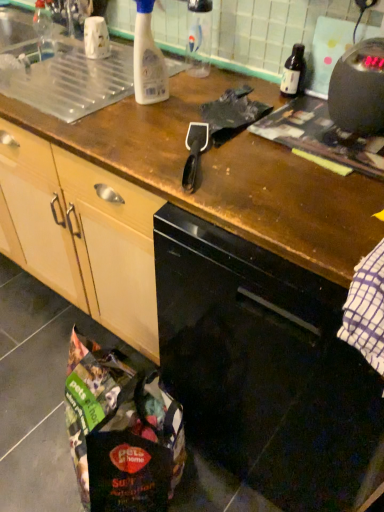
Question: Does transparent plastic bottle at upper center, the 2th bottle from the left, contain black glossy dishwasher at center?

Choices:
 (A) yes
 (B) no

Answer: (B)

Question: From the image's perspective, is transparent plastic bottle at upper center, which appears as the second bottle when viewed from the right, on black glossy dishwasher at center?

Choices:
 (A) yes
 (B) no

Answer: (A)

Question: Does transparent plastic bottle at upper center, the 2th bottle from the left, appear on the right side of black glossy dishwasher at center?

Choices:
 (A) yes
 (B) no

Answer: (B)

Question: Is transparent plastic bottle at upper center, the 2th bottle from the left, completely or partially outside of black glossy dishwasher at center?

Choices:
 (A) yes
 (B) no

Answer: (A)

Question: Could you tell me if transparent plastic bottle at upper center, which appears as the second bottle when viewed from the right, is facing black glossy dishwasher at center?

Choices:
 (A) yes
 (B) no

Answer: (B)

Question: Is black plastic kettle at upper right wider or thinner than translucent plastic spray bottle at upper center, arranged as the third bottle when viewed from the right?

Choices:
 (A) wide
 (B) thin

Answer: (A)

Question: Considering the positions of black plastic kettle at upper right and translucent plastic spray bottle at upper center, arranged as the first bottle when viewed from the left, in the image, is black plastic kettle at upper right taller or shorter than translucent plastic spray bottle at upper center, arranged as the first bottle when viewed from the left,?

Choices:
 (A) tall
 (B) short

Answer: (B)

Question: Considering their positions, is black plastic kettle at upper right located in front of or behind translucent plastic spray bottle at upper center, arranged as the third bottle when viewed from the right?

Choices:
 (A) behind
 (B) front

Answer: (B)

Question: Which is correct: black plastic kettle at upper right is inside translucent plastic spray bottle at upper center, arranged as the third bottle when viewed from the right, or outside of it?

Choices:
 (A) inside
 (B) outside

Answer: (B)

Question: From the image's perspective, is translucent plastic spray bottle at upper center, arranged as the third bottle when viewed from the right, positioned above or below transparent plastic bottle at upper center, which appears as the second bottle when viewed from the right?

Choices:
 (A) below
 (B) above

Answer: (A)

Question: Would you say translucent plastic spray bottle at upper center, arranged as the third bottle when viewed from the right, is to the left or to the right of transparent plastic bottle at upper center, which appears as the second bottle when viewed from the right, in the picture?

Choices:
 (A) right
 (B) left

Answer: (B)

Question: Looking at their shapes, would you say translucent plastic spray bottle at upper center, arranged as the third bottle when viewed from the right, is wider or thinner than transparent plastic bottle at upper center, which appears as the second bottle when viewed from the right?

Choices:
 (A) wide
 (B) thin

Answer: (B)

Question: Would you say translucent plastic spray bottle at upper center, arranged as the third bottle when viewed from the right, is inside or outside transparent plastic bottle at upper center, which appears as the second bottle when viewed from the right?

Choices:
 (A) outside
 (B) inside

Answer: (A)

Question: From a real-world perspective, is transparent plastic sink at upper center positioned above or below transparent plastic bottle at upper center, which appears as the second bottle when viewed from the right?

Choices:
 (A) below
 (B) above

Answer: (A)

Question: Based on their positions, is transparent plastic sink at upper center located to the left or right of transparent plastic bottle at upper center, which appears as the second bottle when viewed from the right?

Choices:
 (A) left
 (B) right

Answer: (A)